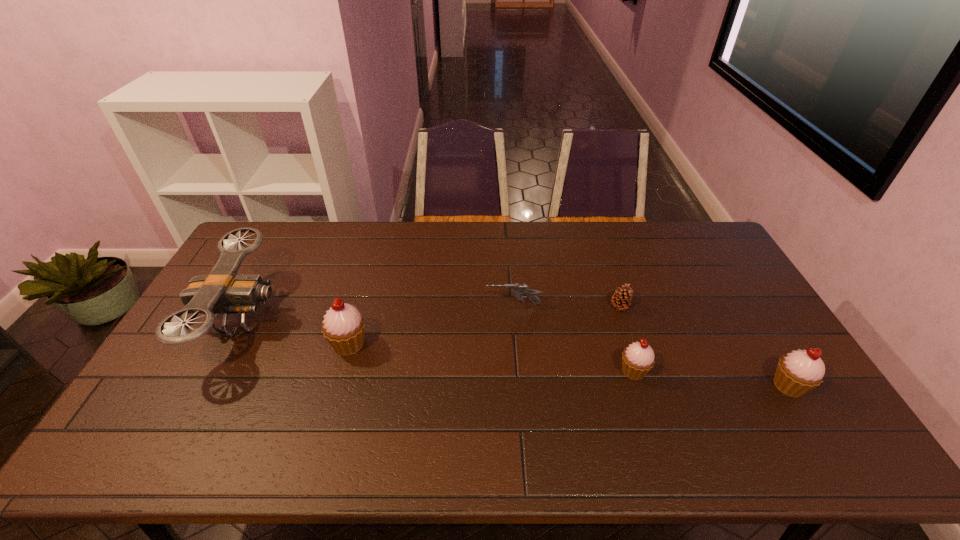
This screenshot has height=540, width=960. What are the coordinates of `the leftmost cupcake` in the screenshot? It's located at (343, 326).

Find the location of a particular element. This screenshot has width=960, height=540. the second cupcake from right to left is located at coordinates (638, 358).

Where is `the shortest cupcake`? Image resolution: width=960 pixels, height=540 pixels. the shortest cupcake is located at coordinates (638, 358).

Image resolution: width=960 pixels, height=540 pixels. In order to click on the fourth shortest object in this screenshot , I will do `click(798, 372)`.

Identify the location of the rightmost cupcake. This screenshot has width=960, height=540. (798, 372).

You are a GUI agent. You are given a task and a screenshot of the screen. Output one action in this format:
    pyautogui.click(x=<x>, y=<y>)
    Task: Click on the drone
    
    Given the screenshot: What is the action you would take?
    pyautogui.click(x=223, y=291)

The width and height of the screenshot is (960, 540). In order to click on pinecone in this screenshot , I will do `click(621, 299)`.

This screenshot has height=540, width=960. Find the location of `gun`. gun is located at coordinates (516, 289).

The width and height of the screenshot is (960, 540). What are the coordinates of `vacant space located on the back of the fifth object from right to left` in the screenshot? It's located at (374, 253).

Locate an element on the screen. This screenshot has height=540, width=960. free space located on the left of the second cupcake from left to right is located at coordinates (476, 371).